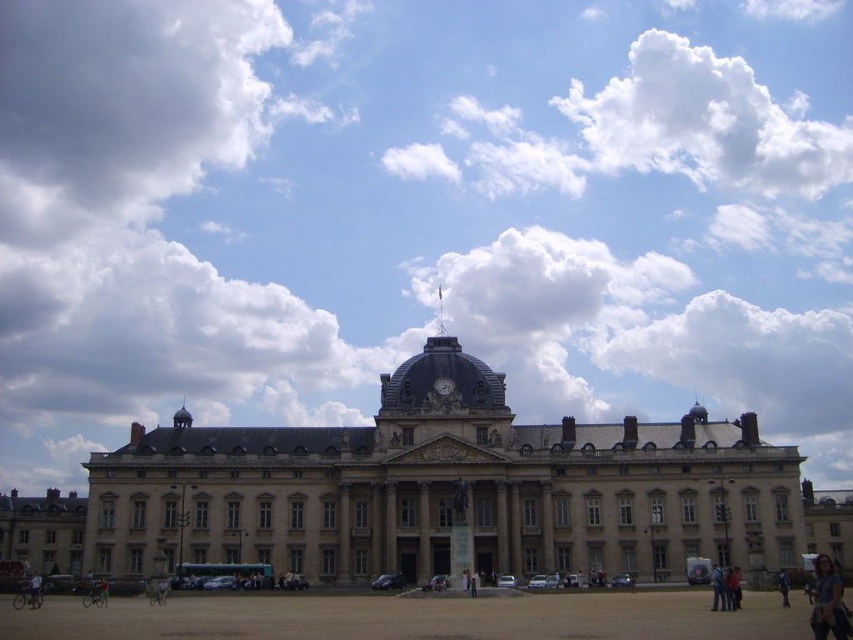
You are an architect analyzing the building and its surroundings. You notice the white fluffy cloud at upper center and the light blue denim jeans at lower left. Which object takes up more space in the image?

The white fluffy cloud at upper center takes up more space in the image because it is bigger than the light blue denim jeans at lower left.

Looking at this image, you are standing in the plaza in front of the beige stone building at center. You want to take a photo of the blue fabric person at lower right without the building blocking the view. Is this possible?

The beige stone building at center is positioned over the blue fabric person at lower right, so taking a photo without the building blocking the view would not be possible from your current position in the plaza.

Based on the scene description, where is the white fluffy cloud at upper center located in terms of coordinates?

The white fluffy cloud at upper center is located at point coordinates of (706, 122).